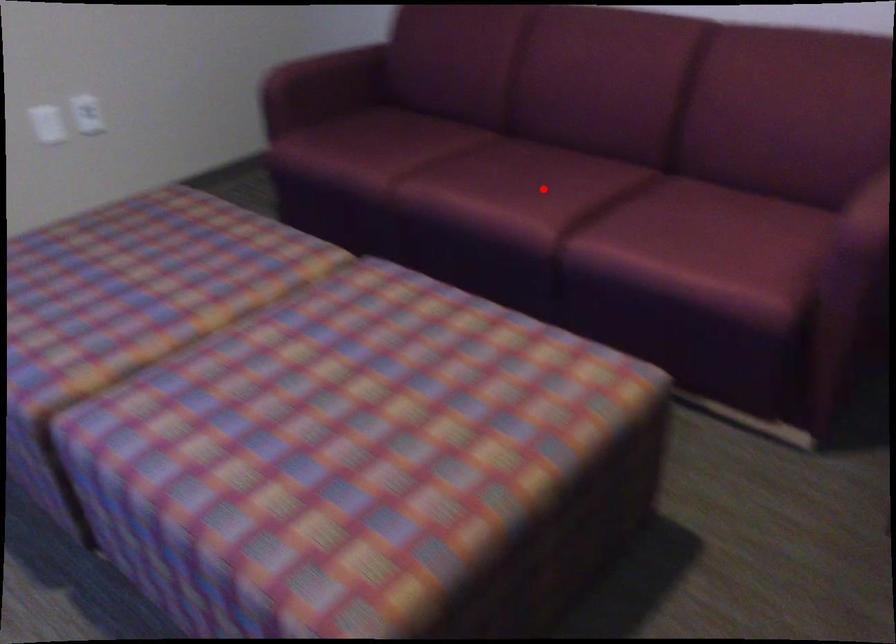
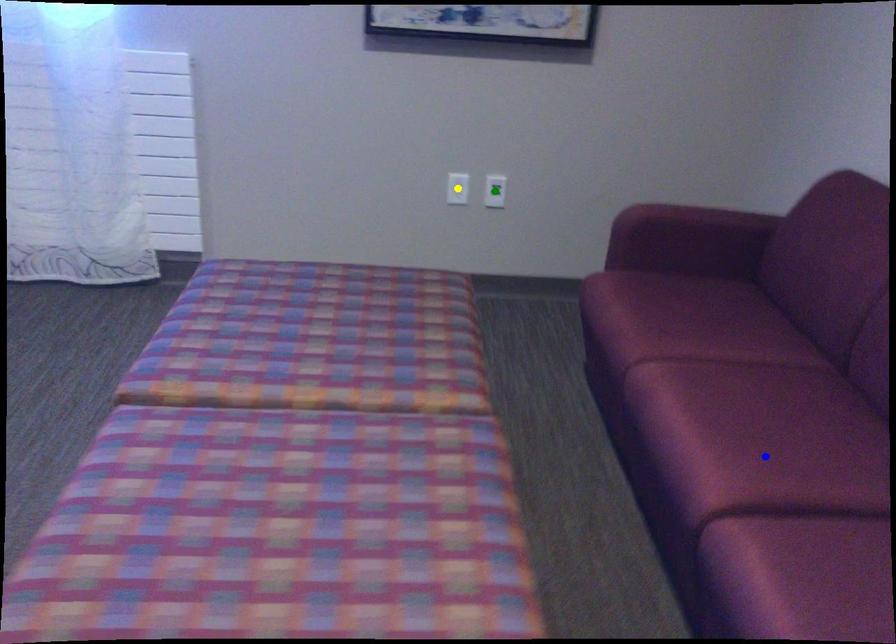
Question: I am providing you with two images of the same scene from different viewpoints. A red point is marked on the first image. You are given multiple points on the second image. Which point in image 2 is actually the same real-world point as the red point in image 1?

Choices:
 (A) blue point
 (B) yellow point
 (C) green point

Answer: (A)